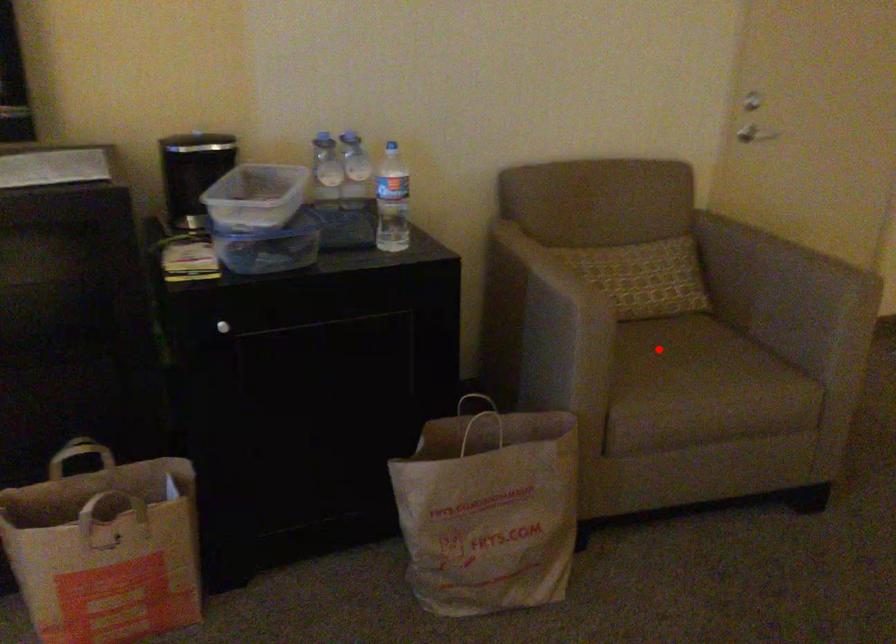
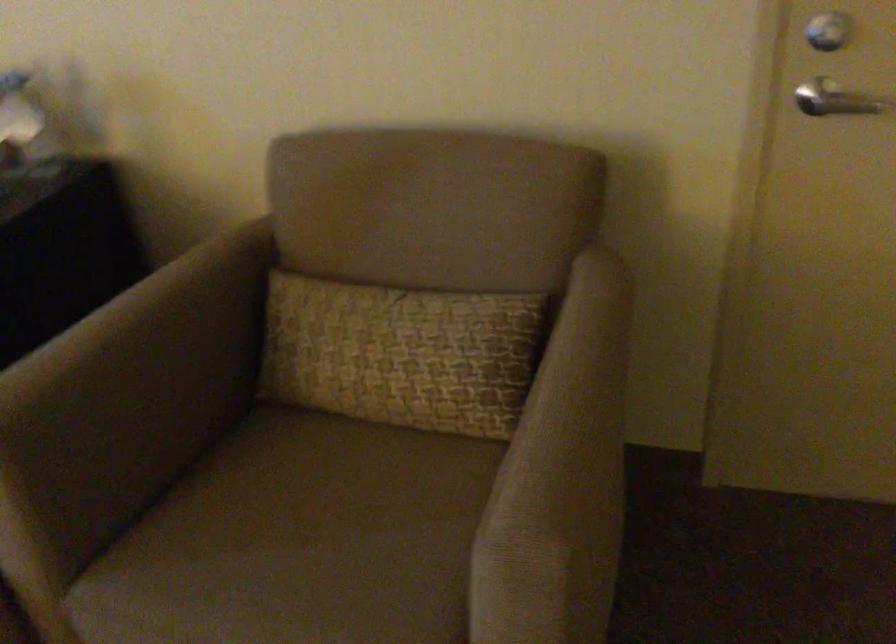
Question: I am providing you with two images of the same scene from different viewpoints. A red point is shown in image1. For the corresponding object point in image2, is it positioned nearer or farther from the camera?

Choices:
 (A) Nearer
 (B) Farther

Answer: (A)